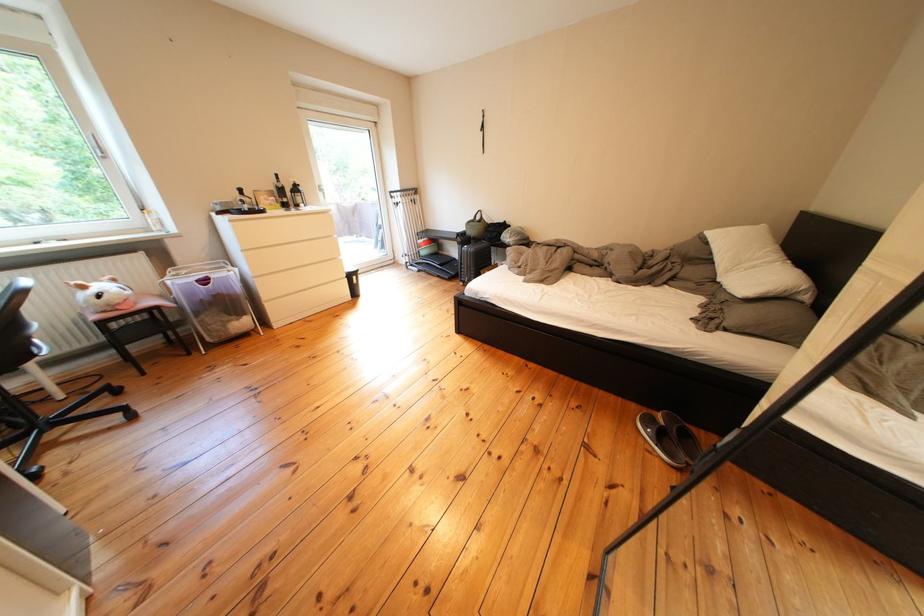
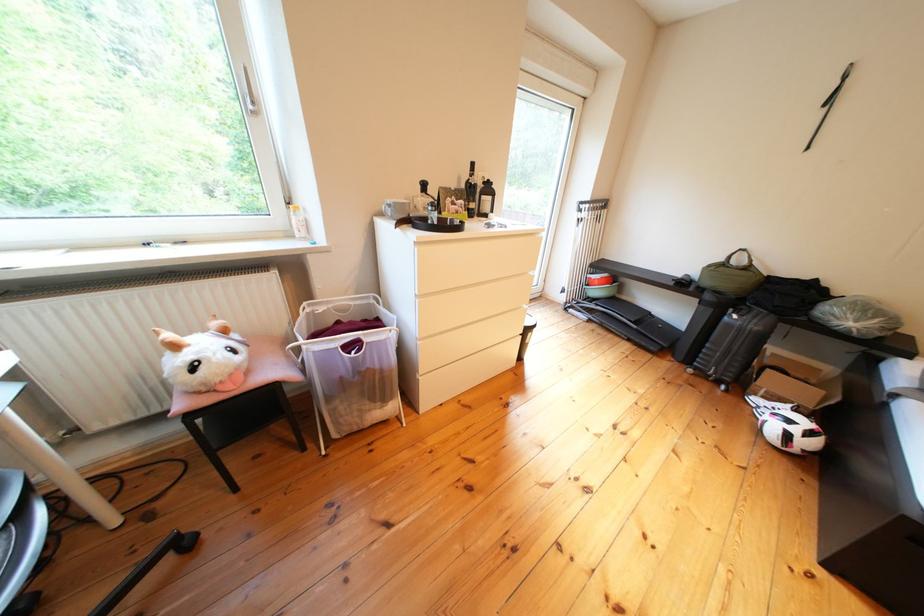
Which direction would the cameraman need to move to produce the second image?

The cameraman moved toward left, forward.